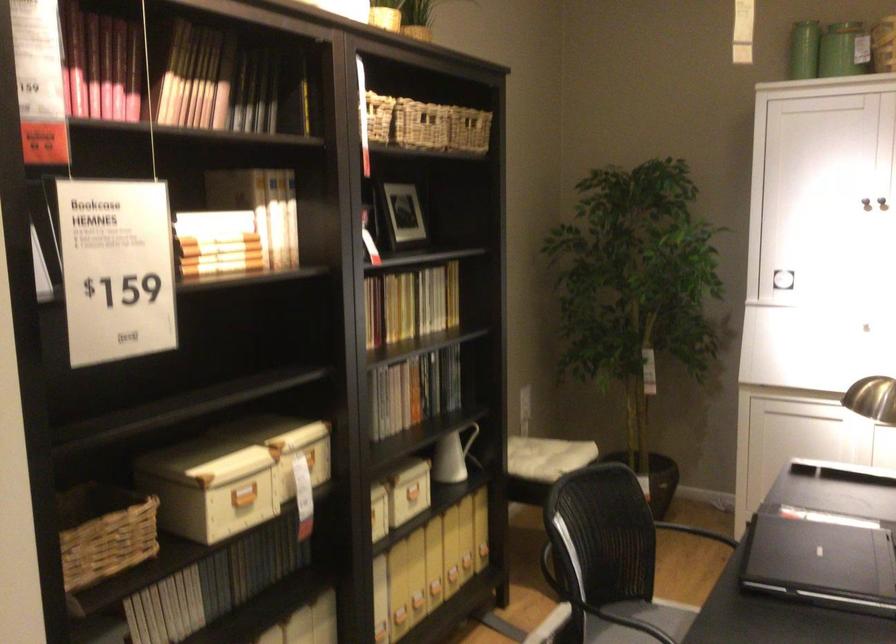
Describe the element at coordinates (791, 351) in the screenshot. I see `the recessed cabinet handle` at that location.